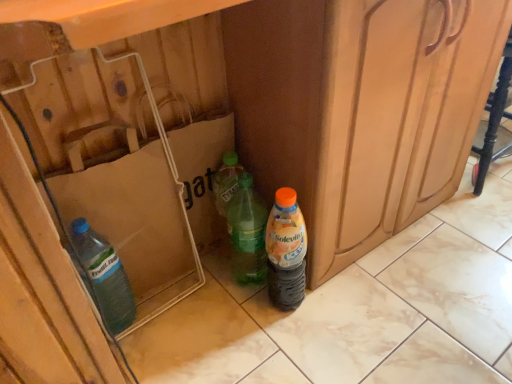
Question: In the image, is green translucent bottle at center, positioned as the 2th bottle in right-to-left order, positioned in front of or behind orange matte plastic bottle at lower right, which is the second bottle from left to right?

Choices:
 (A) behind
 (B) front

Answer: (A)

Question: Considering the positions of green translucent bottle at center, the 1th bottle from the left, and orange matte plastic bottle at lower right, marked as the first bottle in a right-to-left arrangement, in the image, is green translucent bottle at center, the 1th bottle from the left, wider or thinner than orange matte plastic bottle at lower right, marked as the first bottle in a right-to-left arrangement,?

Choices:
 (A) wide
 (B) thin

Answer: (A)

Question: Would you say green translucent bottle at center, the 1th bottle from the left, is to the left or to the right of orange matte plastic bottle at lower right, which is the second bottle from left to right, in the picture?

Choices:
 (A) left
 (B) right

Answer: (A)

Question: Based on their sizes in the image, would you say orange matte plastic bottle at lower right, marked as the first bottle in a right-to-left arrangement, is bigger or smaller than green translucent bottle at center, the 1th bottle from the left?

Choices:
 (A) small
 (B) big

Answer: (A)

Question: Would you say orange matte plastic bottle at lower right, which is the second bottle from left to right, is inside or outside green translucent bottle at center, the 1th bottle from the left?

Choices:
 (A) outside
 (B) inside

Answer: (A)

Question: Would you say orange matte plastic bottle at lower right, marked as the first bottle in a right-to-left arrangement, is to the left or to the right of green translucent bottle at center, positioned as the 2th bottle in right-to-left order, in the picture?

Choices:
 (A) right
 (B) left

Answer: (A)

Question: Considering the positions of orange matte plastic bottle at lower right, marked as the first bottle in a right-to-left arrangement, and green translucent bottle at center, the 1th bottle from the left, in the image, is orange matte plastic bottle at lower right, marked as the first bottle in a right-to-left arrangement, wider or thinner than green translucent bottle at center, the 1th bottle from the left,?

Choices:
 (A) wide
 (B) thin

Answer: (B)